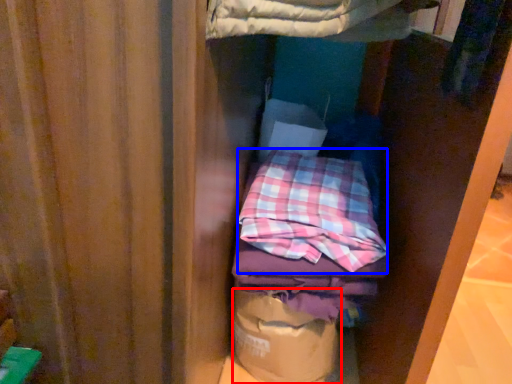
Question: Which object is further to the camera taking this photo, paper bag (highlighted by a red box) or flannel (highlighted by a blue box)?

Choices:
 (A) paper bag
 (B) flannel

Answer: (A)